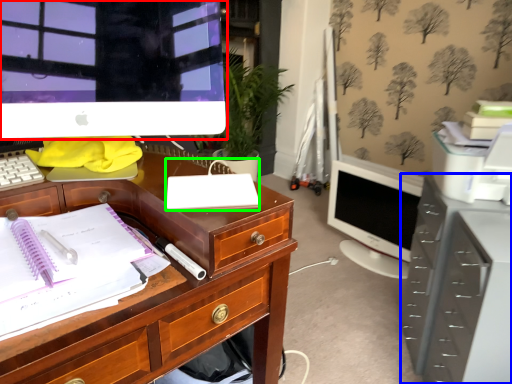
Question: Estimate the real-world distances between objects in this image. Which object is farther from computer monitor (highlighted by a red box), file cabinet (highlighted by a blue box) or office supplies (highlighted by a green box)?

Choices:
 (A) file cabinet
 (B) office supplies

Answer: (A)